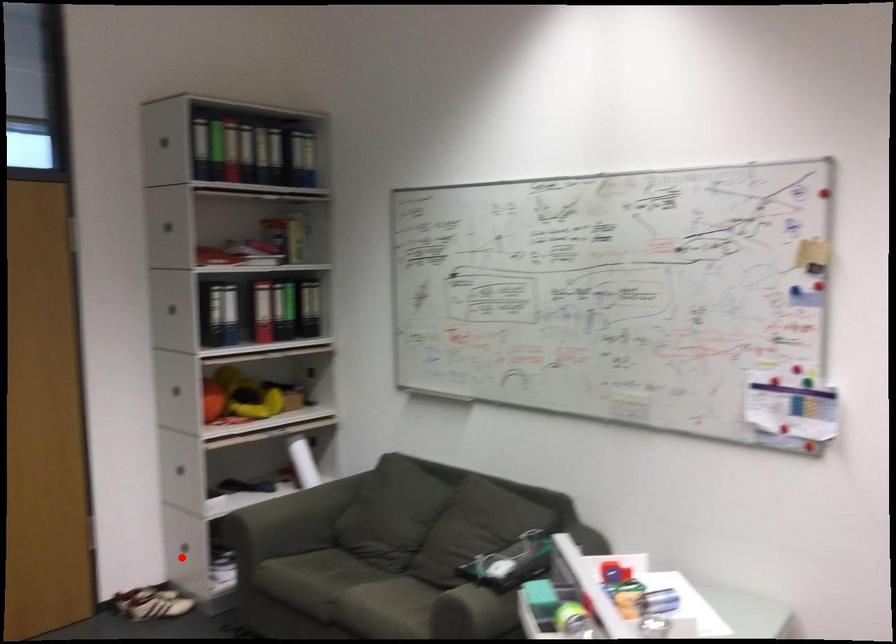
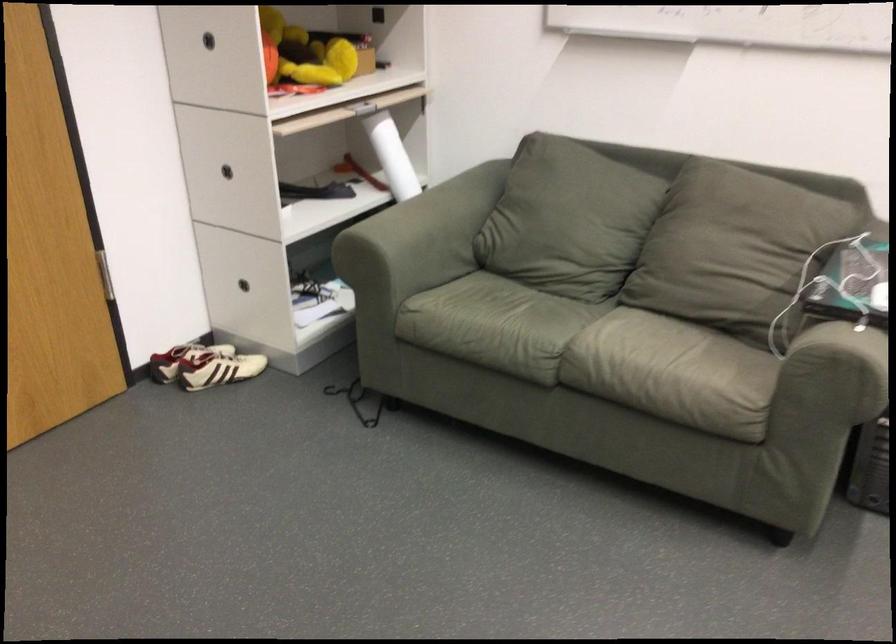
Question: I am providing you with two images of the same scene from different viewpoints. Image1 has a red point marked. In image2, the corresponding 3D location appears at what relative position? Reply with the corresponding letter.

Choices:
 (A) Closer
 (B) Farther

Answer: (A)